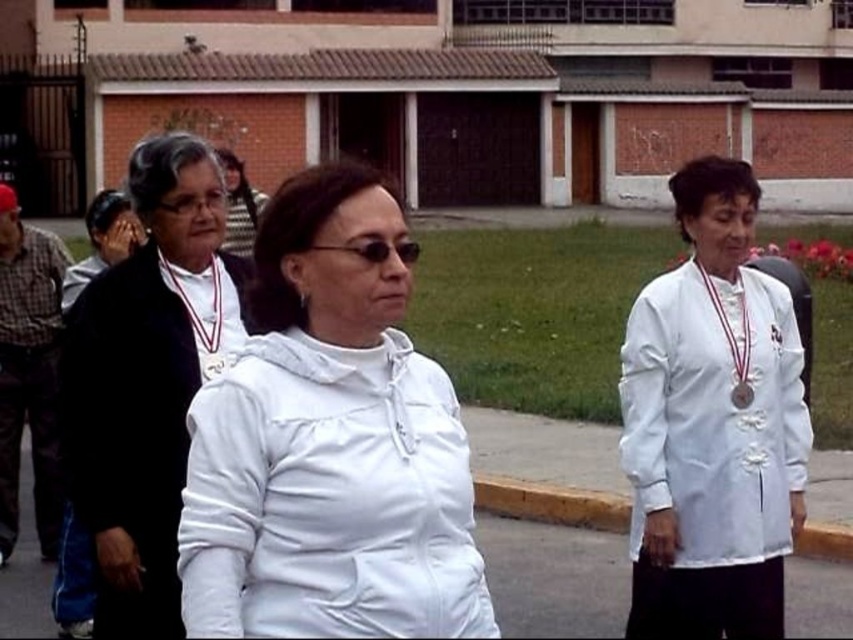
You are standing at the position of point (376, 250) and want to move towards point (131, 621). Is the path between these two points clear of any obstacles?

Point (131, 621) is further to the camera than point (376, 250), so the path between them is clear of obstacles.

You are standing at the point marked as point [148,380] in the image. What object are you currently standing on?

The point [148,380] is on the matte black jacket at center, so you are standing on the matte black jacket at center.

You are a photographer at the event and need to adjust your camera settings to focus on both the matte black jacket at center and the white matte lab coat at center. Which object should you focus on first to ensure both are in focus?

The matte black jacket at center is located above the white matte lab coat at center. Since the camera focus should start with the closer object, you should focus on the white matte lab coat at center first to ensure both are in focus.